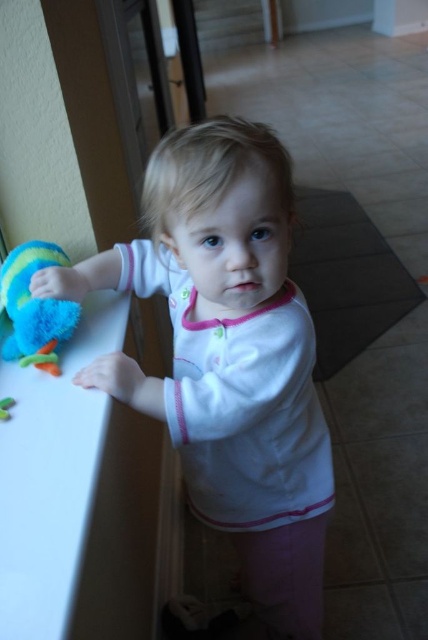
Based on the photo, you are a photographer taking a picture of the white soft shirt at center. The camera you are using has a minimum focusing distance of 24 inches. Can you take a clear photo without moving the shirt?

The white soft shirt at center and camera are 24.61 inches apart, which is just over the minimum focusing distance of 24 inches. Therefore, you can take a clear photo without moving the shirt.

The scene shows a child in a white soft shirt at center and a soft plush toy at left. Which object is taller?

The white soft shirt at center is much taller than the soft plush toy at left.

Looking at this image, you are a parent trying to dress your child. You see the white soft shirt at center and the soft plush toy at left. Which item is located lower in the image?

The white soft shirt at center is positioned under the soft plush toy at left, so the white soft shirt at center is located lower in the image.